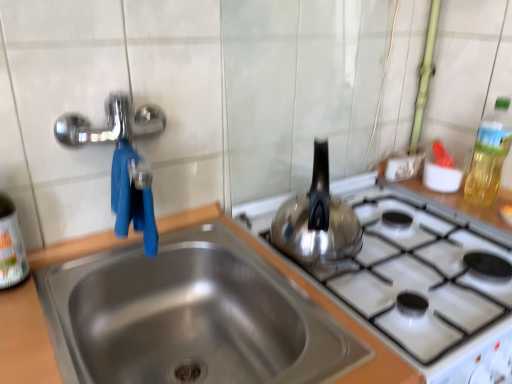
Question: Is stainless steel sink at center thinner than white plastic bottle at left, acting as the second bottle starting from the right?

Choices:
 (A) no
 (B) yes

Answer: (A)

Question: Does stainless steel sink at center have a greater height compared to white plastic bottle at left, which ranks as the 1th bottle in left-to-right order?

Choices:
 (A) yes
 (B) no

Answer: (B)

Question: From the image's perspective, is stainless steel sink at center on top of white plastic bottle at left, the 1th bottle in the front-to-back sequence?

Choices:
 (A) no
 (B) yes

Answer: (A)

Question: From the image's perspective, would you say stainless steel sink at center is shown under white plastic bottle at left, acting as the second bottle starting from the right?

Choices:
 (A) no
 (B) yes

Answer: (B)

Question: Is the depth of stainless steel sink at center greater than that of white plastic bottle at left, which ranks as the 1th bottle in left-to-right order?

Choices:
 (A) yes
 (B) no

Answer: (B)

Question: Considering the relative positions of white plastic bottle at left, which ranks as the 1th bottle in left-to-right order, and translucent yellow bottle at upper right, arranged as the 1th bottle when viewed from the back, in the image provided, is white plastic bottle at left, which ranks as the 1th bottle in left-to-right order, to the left or to the right of translucent yellow bottle at upper right, arranged as the 1th bottle when viewed from the back,?

Choices:
 (A) right
 (B) left

Answer: (B)

Question: From the image's perspective, relative to translucent yellow bottle at upper right, arranged as the 1th bottle when viewed from the back, is white plastic bottle at left, which ranks as the 1th bottle in left-to-right order, above or below?

Choices:
 (A) below
 (B) above

Answer: (A)

Question: Is white plastic bottle at left, the 1th bottle in the front-to-back sequence, situated inside translucent yellow bottle at upper right, the second bottle when ordered from front to back, or outside?

Choices:
 (A) outside
 (B) inside

Answer: (A)

Question: Is point (10, 221) closer or farther from the camera than point (498, 157)?

Choices:
 (A) closer
 (B) farther

Answer: (A)

Question: Looking at the image, does white plastic bottle at left, which appears as the 2th bottle when viewed from the back, seem bigger or smaller compared to shiny metallic kettle at right?

Choices:
 (A) small
 (B) big

Answer: (A)

Question: From their relative heights in the image, would you say white plastic bottle at left, acting as the second bottle starting from the right, is taller or shorter than shiny metallic kettle at right?

Choices:
 (A) short
 (B) tall

Answer: (B)

Question: From a real-world perspective, is white plastic bottle at left, which ranks as the 1th bottle in left-to-right order, physically located above or below shiny metallic kettle at right?

Choices:
 (A) above
 (B) below

Answer: (B)

Question: Based on their positions, is white plastic bottle at left, acting as the second bottle starting from the right, located to the left or right of shiny metallic kettle at right?

Choices:
 (A) left
 (B) right

Answer: (A)

Question: Considering the positions of point (499, 167) and point (269, 230), is point (499, 167) closer or farther from the camera than point (269, 230)?

Choices:
 (A) closer
 (B) farther

Answer: (B)

Question: From the image's perspective, is translucent yellow bottle at upper right, the second bottle when ordered from front to back, above or below shiny metallic kettle at right?

Choices:
 (A) below
 (B) above

Answer: (B)